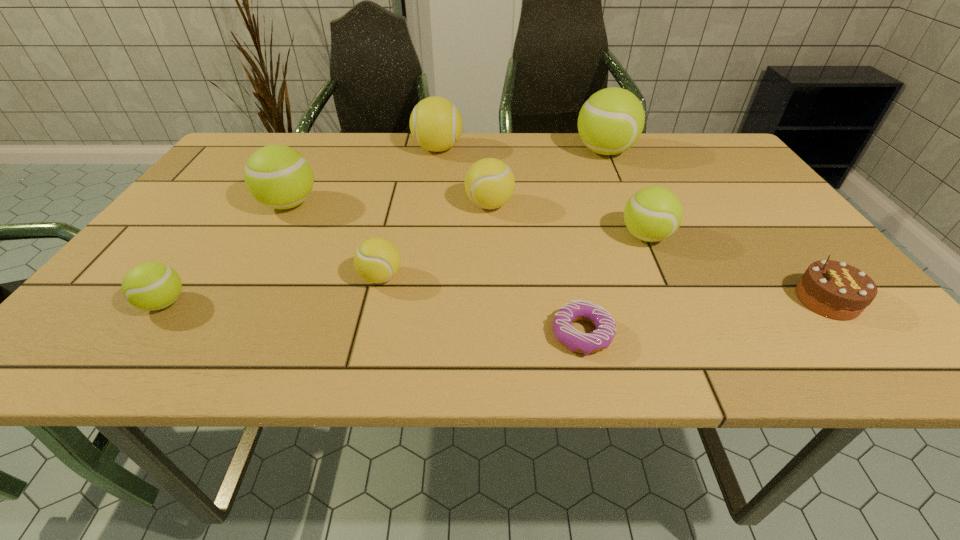
Find the location of a particular element. Image resolution: width=960 pixels, height=540 pixels. vacant point at the right edge is located at coordinates (726, 219).

In the image, there is a desktop. Where is `free region at the far left corner`? The height and width of the screenshot is (540, 960). free region at the far left corner is located at coordinates (228, 158).

The width and height of the screenshot is (960, 540). In the image, there is a desktop. Identify the location of free region at the far right corner. (725, 153).

Where is `vacant area between the leftmost object and the biggest yellow tennis ball`? The height and width of the screenshot is (540, 960). vacant area between the leftmost object and the biggest yellow tennis ball is located at coordinates (301, 226).

Find the location of a particular element. The height and width of the screenshot is (540, 960). free space that is in between the sixth tennis ball from right to left and the farthest yellow tennis ball is located at coordinates (363, 177).

At what (x,y) coordinates should I click in order to perform the action: click on vacant area that lies between the nearest yellow tennis ball and the second green tennis ball from left to right. Please return your answer as a coordinate pair (x, y). This screenshot has height=540, width=960. Looking at the image, I should click on (335, 241).

I want to click on vacant area between the nearest green tennis ball and the farthest yellow tennis ball, so click(301, 226).

The width and height of the screenshot is (960, 540). In order to click on vacant area that lies between the nearest yellow tennis ball and the second smallest green tennis ball in this screenshot , I will do `click(514, 256)`.

The height and width of the screenshot is (540, 960). I want to click on free spot between the eighth object from right to left and the rightmost yellow tennis ball, so click(389, 205).

Where is `vacant space in between the tallest tennis ball and the rightmost object`? vacant space in between the tallest tennis ball and the rightmost object is located at coordinates (716, 226).